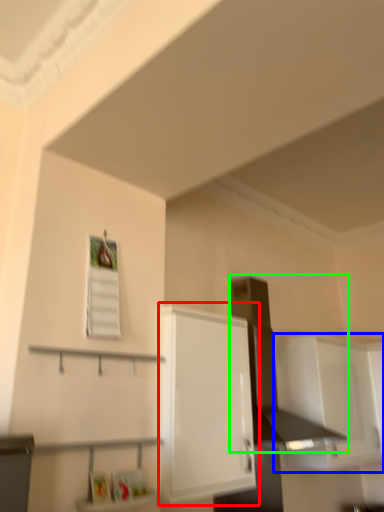
Question: Which object is positioned closest to cabinetry (highlighted by a red box)? Select from cabinetry (highlighted by a blue box) and vent (highlighted by a green box).

Choices:
 (A) cabinetry
 (B) vent

Answer: (B)